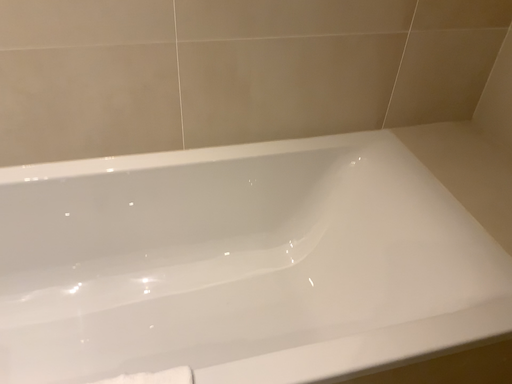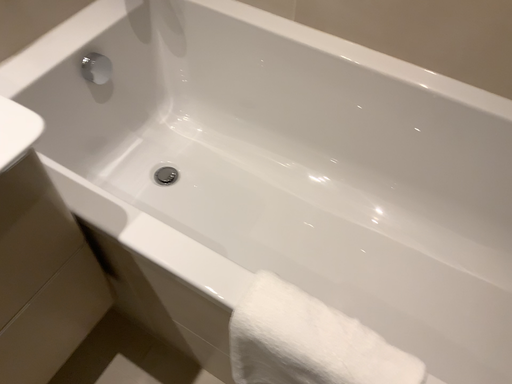
Question: Which way did the camera rotate in the video?

Choices:
 (A) rotated left
 (B) rotated right

Answer: (A)